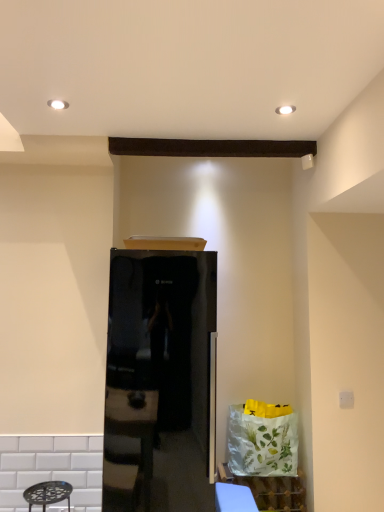
Question: From the image's perspective, is white glossy cabinet at lower right above or below glossy black refrigerator at center?

Choices:
 (A) below
 (B) above

Answer: (A)

Question: In the image, is white glossy cabinet at lower right positioned in front of or behind glossy black refrigerator at center?

Choices:
 (A) front
 (B) behind

Answer: (B)

Question: Based on their relative distances, which object is farther from the glossy black refrigerator at center?

Choices:
 (A) blue fabric table at lower center
 (B) white glossy cabinet at lower right

Answer: (B)

Question: Estimate the real-world distances between objects in this image. Which object is closer to the white glossy cabinet at lower right?

Choices:
 (A) glossy black refrigerator at center
 (B) blue fabric table at lower center

Answer: (B)